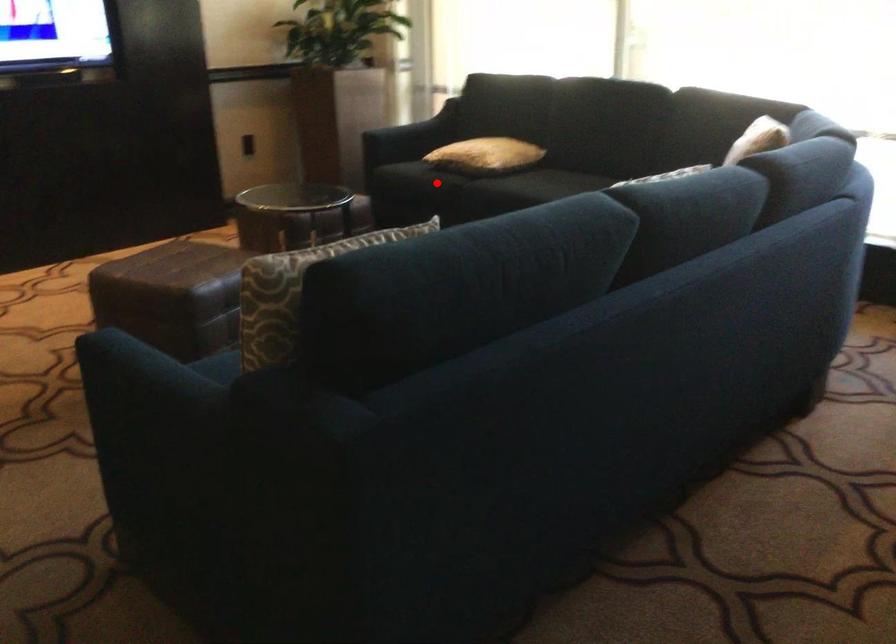
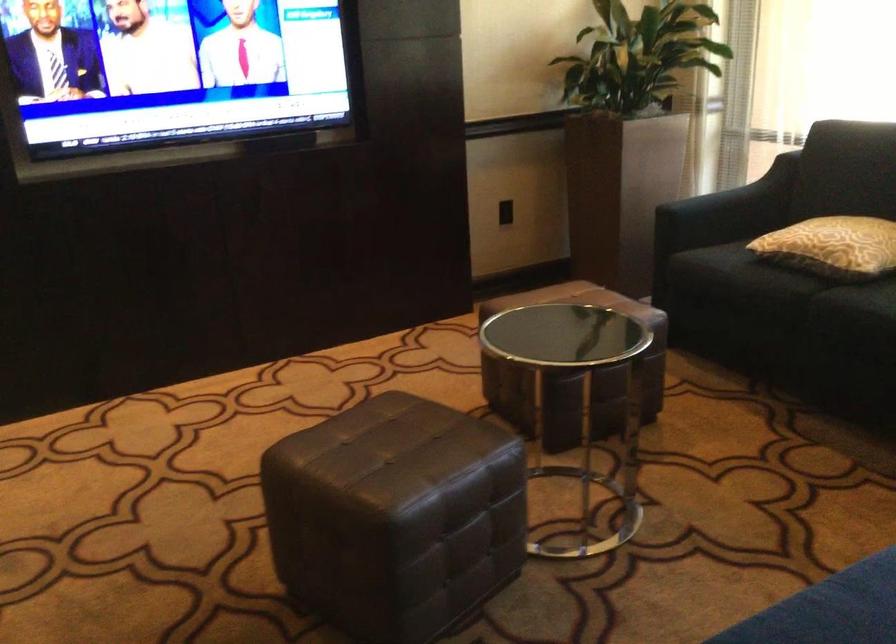
Find the pixel in the second image that matches the highlighted location in the first image.

(767, 283)